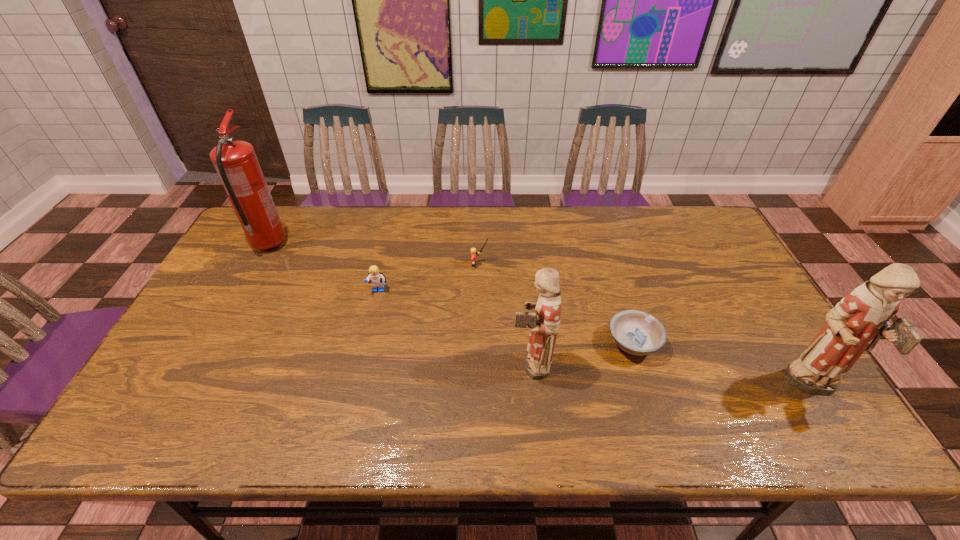
I want to click on free space between the shortest object and the nearer Lego, so click(506, 317).

I want to click on empty space between the fifth object from right to left and the shortest object, so click(x=506, y=317).

Where is `empty space that is in between the farther Lego and the third tallest object`? The width and height of the screenshot is (960, 540). empty space that is in between the farther Lego and the third tallest object is located at coordinates (505, 314).

Image resolution: width=960 pixels, height=540 pixels. In order to click on vacant point located between the right Lego and the leftmost object in this screenshot , I will do `click(374, 254)`.

This screenshot has height=540, width=960. Identify the location of empty location between the rightmost object and the fifth object from left to right. (724, 366).

Identify the location of free point between the right figurine and the shortest object. The image size is (960, 540). click(724, 366).

Locate an element on the screen. This screenshot has height=540, width=960. free space between the right figurine and the shortest object is located at coordinates (724, 366).

The width and height of the screenshot is (960, 540). What are the coordinates of `free spot between the third tallest object and the fourth object from right to left` in the screenshot? It's located at (505, 314).

Identify which object is located as the fifth nearest to the right figurine. Please provide its 2D coordinates. Your answer should be formatted as a tuple, i.e. [(x, y)], where the tuple contains the x and y coordinates of a point satisfying the conditions above.

[(235, 161)]

At what (x,y) coordinates should I click in order to perform the action: click on the fifth closest object to the fourth nearest object. Please return your answer as a coordinate pair (x, y). The width and height of the screenshot is (960, 540). Looking at the image, I should click on (862, 317).